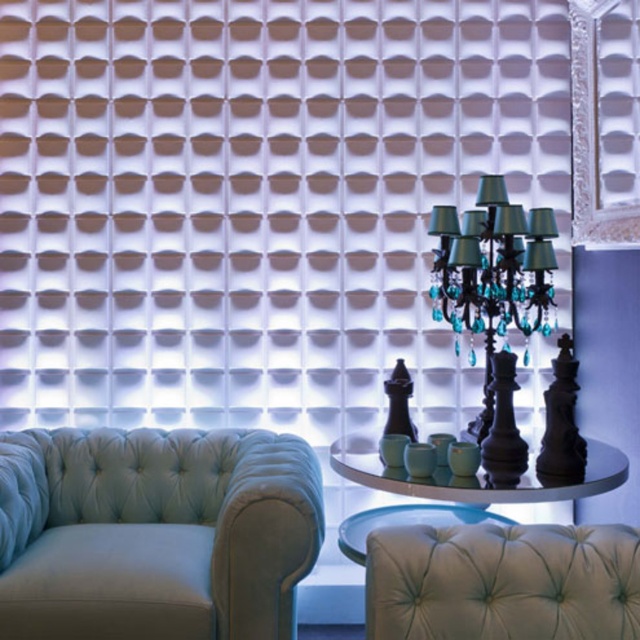
Question: Can you confirm if light blue velvet couch at lower left is wider than black glass chandelier at center?

Choices:
 (A) no
 (B) yes

Answer: (B)

Question: Does black glass chandelier at center have a smaller size compared to shiny black chess set at center?

Choices:
 (A) no
 (B) yes

Answer: (A)

Question: Which point is farther to the camera?

Choices:
 (A) light blue velvet couch at lower left
 (B) tufted leather armchair at center
 (C) black glass chandelier at center

Answer: (C)

Question: Which object appears closest to the camera in this image?

Choices:
 (A) tufted leather armchair at center
 (B) shiny black chess set at center
 (C) black glass chandelier at center

Answer: (A)

Question: Which point is farther to the camera?

Choices:
 (A) shiny black chess set at center
 (B) tufted leather armchair at center

Answer: (A)

Question: Does light blue velvet couch at lower left come in front of shiny black chess set at center?

Choices:
 (A) no
 (B) yes

Answer: (A)